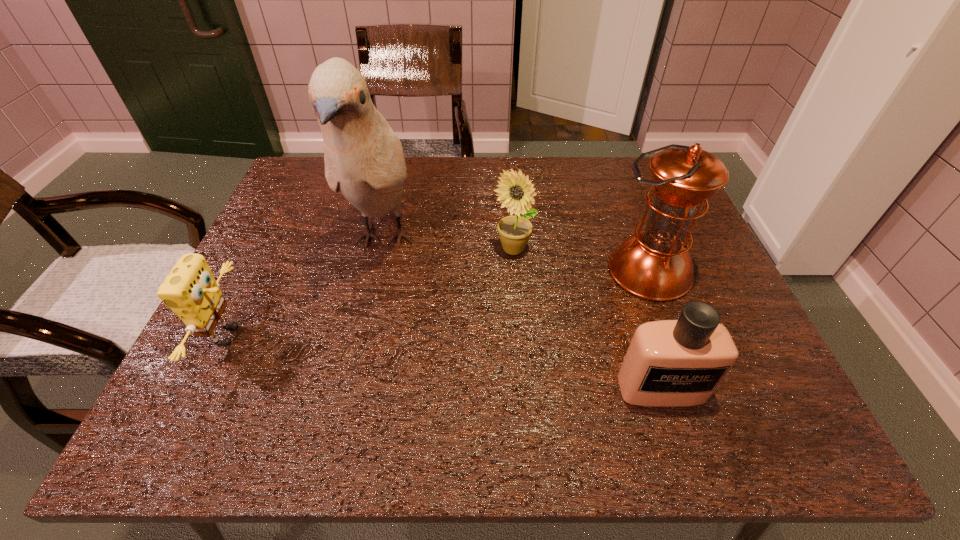
You are a GUI agent. You are given a task and a screenshot of the screen. Output one action in this format:
    pyautogui.click(x=<x>, y=<y>)
    Task: Click on the blank space at the right edge of the desktop
    This screenshot has width=960, height=540.
    Given the screenshot: What is the action you would take?
    pyautogui.click(x=731, y=384)

This screenshot has width=960, height=540. In order to click on blank space at the near left corner of the desktop in this screenshot , I will do `click(170, 425)`.

In the image, there is a desktop. Where is `free space at the near right corner`? The height and width of the screenshot is (540, 960). free space at the near right corner is located at coordinates (706, 409).

Where is `vacant space that's between the perfume and the fourth object from right to left`? Image resolution: width=960 pixels, height=540 pixels. vacant space that's between the perfume and the fourth object from right to left is located at coordinates (522, 314).

Find the location of `vacant area that lies between the parakeet and the sunflower`. vacant area that lies between the parakeet and the sunflower is located at coordinates (448, 245).

Locate an element on the screen. empty space between the leftmost object and the parakeet is located at coordinates (306, 288).

Locate an element on the screen. The image size is (960, 540). free space that is in between the oil lamp and the leftmost object is located at coordinates (439, 303).

Where is `free space between the leftmost object and the third object from right to left`? free space between the leftmost object and the third object from right to left is located at coordinates (371, 293).

Find the location of a particular element. The image size is (960, 540). free space between the second tallest object and the sponge is located at coordinates (439, 303).

This screenshot has width=960, height=540. Find the location of `empty space that is in between the perfume and the leftmost object`. empty space that is in between the perfume and the leftmost object is located at coordinates (445, 362).